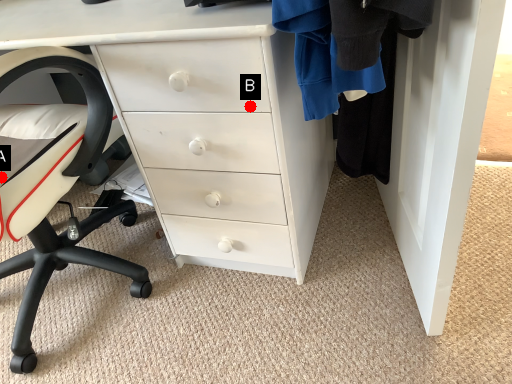
Question: Two points are circled on the image, labeled by A and B beside each circle. Which point is closer to the camera?

Choices:
 (A) A is closer
 (B) B is closer

Answer: (B)